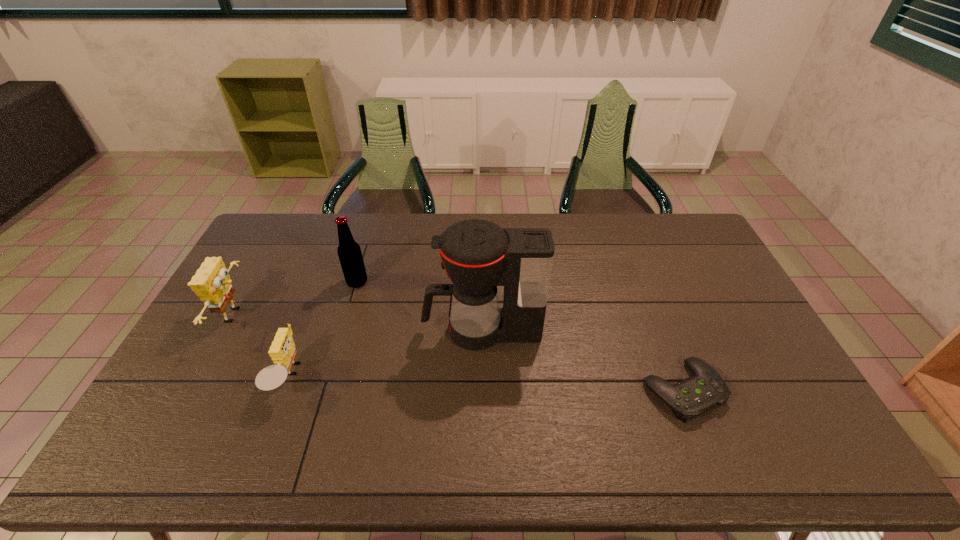
You are a GUI agent. You are given a task and a screenshot of the screen. Output one action in this format:
    pyautogui.click(x=<x>, y=<y>)
    Task: Click on the second object from right to left
    Image resolution: width=960 pixels, height=540 pixels.
    Given the screenshot: What is the action you would take?
    pyautogui.click(x=478, y=255)

Where is `coffee maker`? This screenshot has height=540, width=960. coffee maker is located at coordinates (478, 255).

At what (x,y) coordinates should I click in order to perform the action: click on the fourth shortest object. Please return your answer as a coordinate pair (x, y). The image size is (960, 540). Looking at the image, I should click on (349, 252).

Where is `the third object from left to right`? This screenshot has width=960, height=540. the third object from left to right is located at coordinates (349, 252).

At what (x,y) coordinates should I click in order to perform the action: click on the left sponge. Please return your answer as a coordinate pair (x, y). Image resolution: width=960 pixels, height=540 pixels. Looking at the image, I should click on (212, 283).

Where is `the third tallest object`? the third tallest object is located at coordinates (212, 283).

The width and height of the screenshot is (960, 540). What are the coordinates of `the shorter sponge` in the screenshot? It's located at (282, 351).

Where is `the right sponge`? The image size is (960, 540). the right sponge is located at coordinates (282, 351).

Where is `the rightmost object`? This screenshot has height=540, width=960. the rightmost object is located at coordinates [x=695, y=395].

Find the location of a particular element. The width and height of the screenshot is (960, 540). the shortest object is located at coordinates (695, 395).